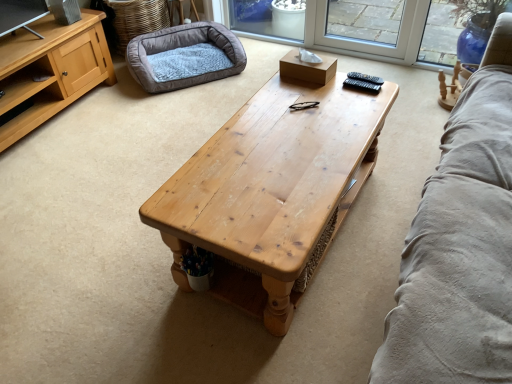
Locate an element on the screen. The image size is (512, 384). free space in front of soft gray plush dog bed at upper left is located at coordinates (161, 123).